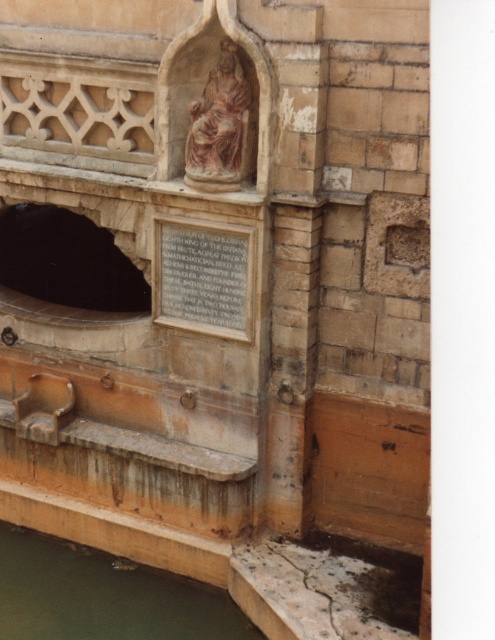
You are standing in front of the stone structure and notice a point marked at coordinates (103,595). Based on the scene description, what does this point most likely represent?

The point at (103,595) corresponds to the greenish murky water at lower left.

You are an architect examining this historical structure. You need to install a light fixture that must be placed at the same height as the matte pink stone statue at center. Given the black stone hole at lower left, which is part of the structure, can you use it as a mounting point for the light fixture?

The black stone hole at lower left has a greater height compared to the matte pink stone statue at center. Therefore, if the light fixture needs to be at the same height as the statue, the hole is taller than the required height, so it might not be suitable unless adjusted. However, since the hole is part of the structure, its exact dimensions and structural integrity should be checked before deciding.

You are a visitor standing in front of the stone structure. You see the greenish murky water at lower left and the matte stone plaque at center. Which object is shorter in height?

The greenish murky water at lower left has a lesser height compared to the matte stone plaque at center, so the greenish murky water at lower left is shorter in height.